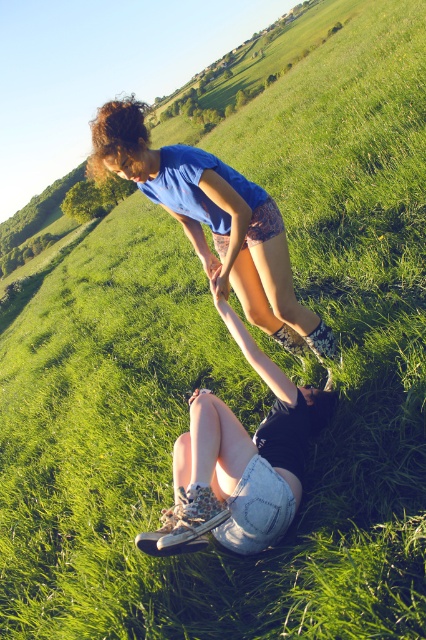
You are trying to determine the position of two people in the image. Which person is closer to you, the one wearing the blue fabric shorts at center or the one in denim shorts at center?

The blue fabric shorts at center is closer to you because the denim shorts at center is behind it.

Based on the coordinates provided, can you identify which object in the scene corresponds to the point at (213, 221)?

The point at (213, 221) corresponds to the blue fabric shorts at center.

You are a photographer trying to capture the scene where two people are interacting in the green field. You notice the blue fabric shorts at center and denim shorts at center. Which pair of shorts is positioned higher in the image?

The blue fabric shorts at center is above denim shorts at center, so the blue fabric shorts at center is positioned higher in the image.